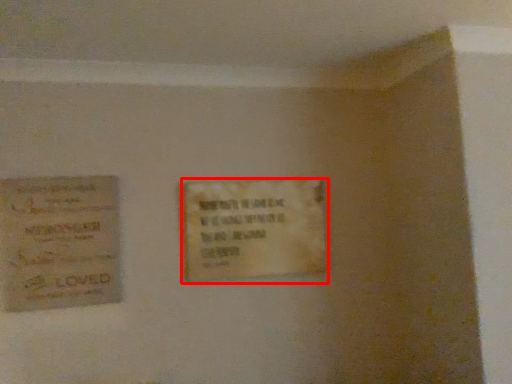
Question: From the image, what is the correct spatial relationship of plaque (annotated by the red box) in relation to poster?

Choices:
 (A) left
 (B) right

Answer: (B)